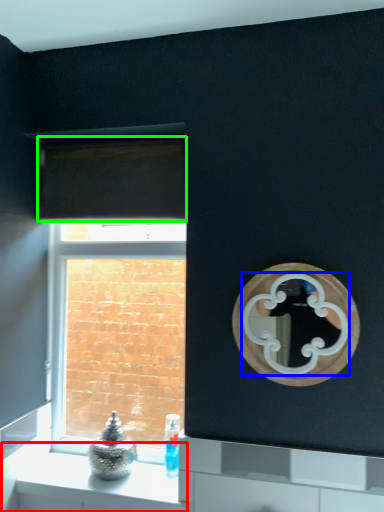
Question: Based on their relative distances, which object is farther from counter (highlighted by a red box)? Choose from mirror (highlighted by a blue box) and curtain (highlighted by a green box).

Choices:
 (A) mirror
 (B) curtain

Answer: (B)